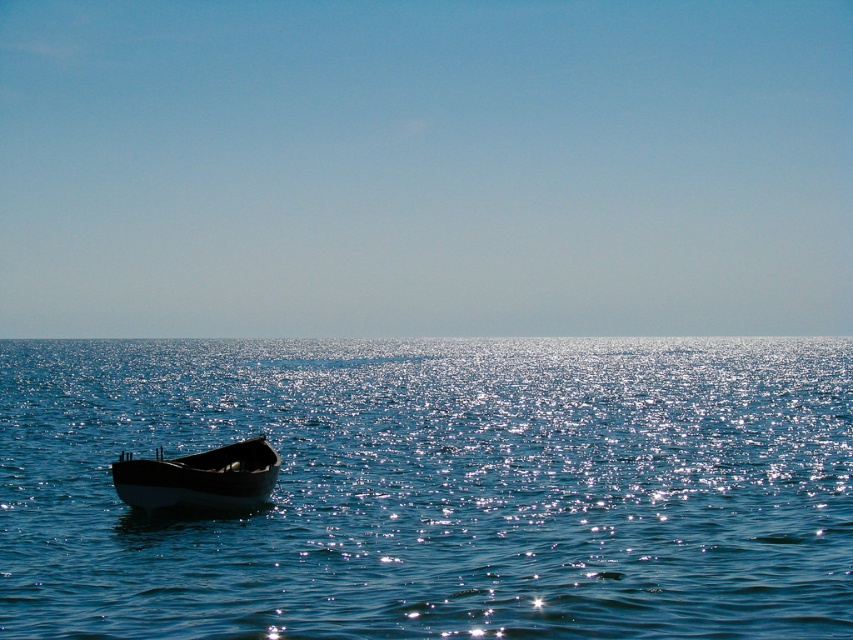
You are standing at the point marked as point (436, 486) in the image. What do you see directly in front of you?

You see glistening blue water at center directly in front of you at point (436, 486).